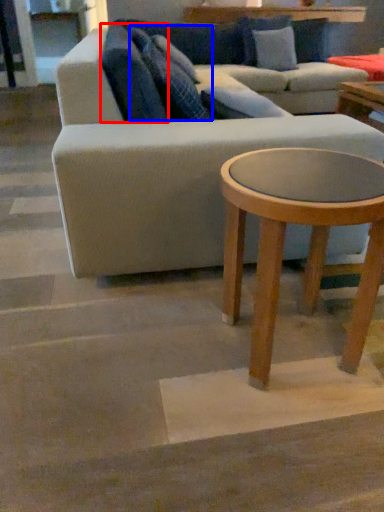
Question: Which of the following is the closest to the observer, pillow (highlighted by a red box) or pillow (highlighted by a blue box)?

Choices:
 (A) pillow
 (B) pillow

Answer: (A)